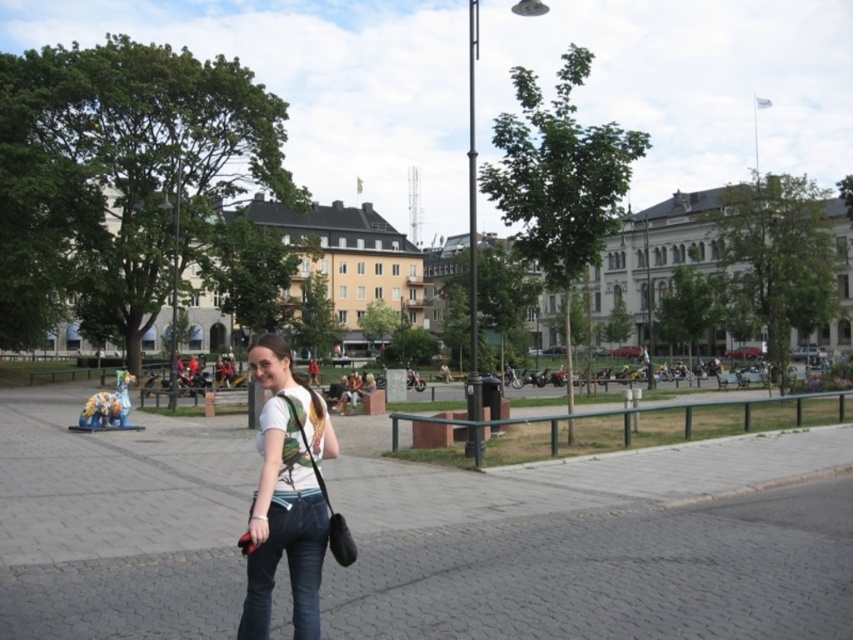
Question: Can you confirm if white matte t-shirt at center is smaller than black leather shoulder bag at center?

Choices:
 (A) yes
 (B) no

Answer: (A)

Question: Where is gray concrete pavement at center located in relation to denim at center in the image?

Choices:
 (A) left
 (B) right

Answer: (A)

Question: Observing the image, what is the correct spatial positioning of gray concrete pavement at center in reference to white matte t-shirt at center?

Choices:
 (A) left
 (B) right

Answer: (A)

Question: Considering the real-world distances, which object is farthest from the gray concrete pavement at center?

Choices:
 (A) white matte t-shirt at center
 (B) black leather shoulder bag at center

Answer: (A)

Question: Which object is closer to the camera taking this photo?

Choices:
 (A) denim at center
 (B) white matte t-shirt at center
 (C) black leather shoulder bag at center
 (D) gray concrete pavement at center

Answer: (A)

Question: Which is farther from the denim at center?

Choices:
 (A) gray concrete pavement at center
 (B) black leather shoulder bag at center
 (C) white matte t-shirt at center

Answer: (A)